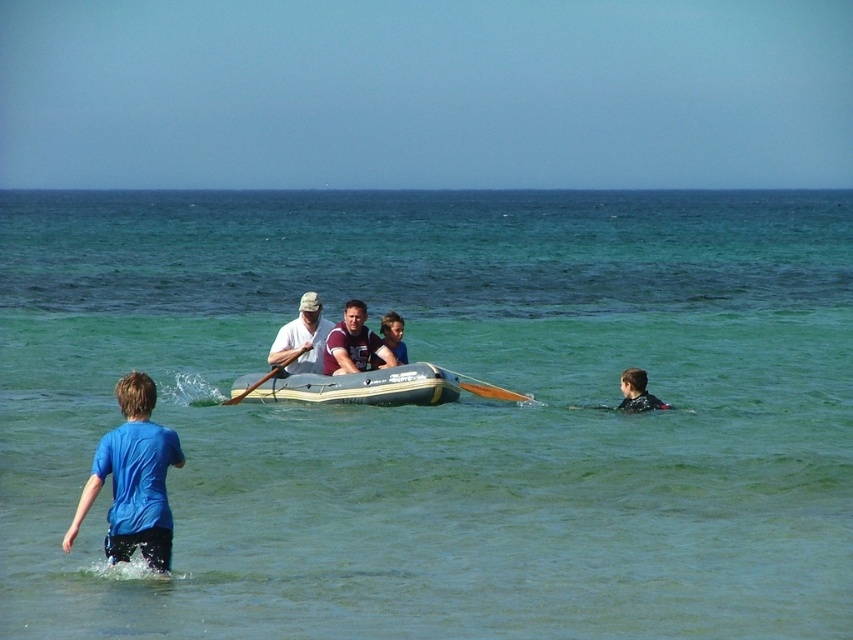
What are the coordinates of the white matte life jacket at center?

The white matte life jacket at center is located at coordinates point (302, 337).

You are standing at the edge of the beach and see the blue cotton shirt at lower left and the wooden paddle at center. Which object is positioned more to the right side?

The blue cotton shirt at lower left is positioned more to the right side than the wooden paddle at center.

You are a photographer trying to capture a clear shot of the wooden paddle at center and the orange wood paddle at center. Which paddle should you focus on first to ensure it is in the foreground of your photo?

The orange wood paddle at center should be focused on first because the wooden paddle at center is behind it, making the orange wood paddle closer to the camera and thus the foreground.